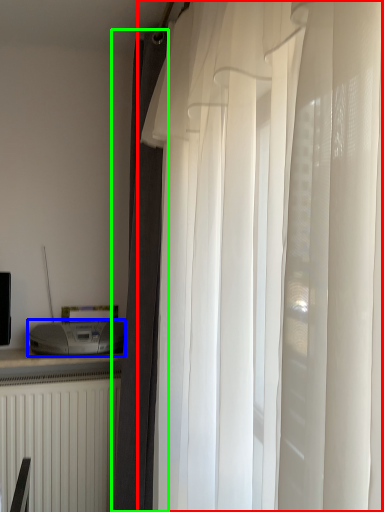
Question: Which object is the farthest from curtain (highlighted by a red box)? Choose among these: appliance (highlighted by a blue box) or curtain (highlighted by a green box).

Choices:
 (A) appliance
 (B) curtain

Answer: (A)